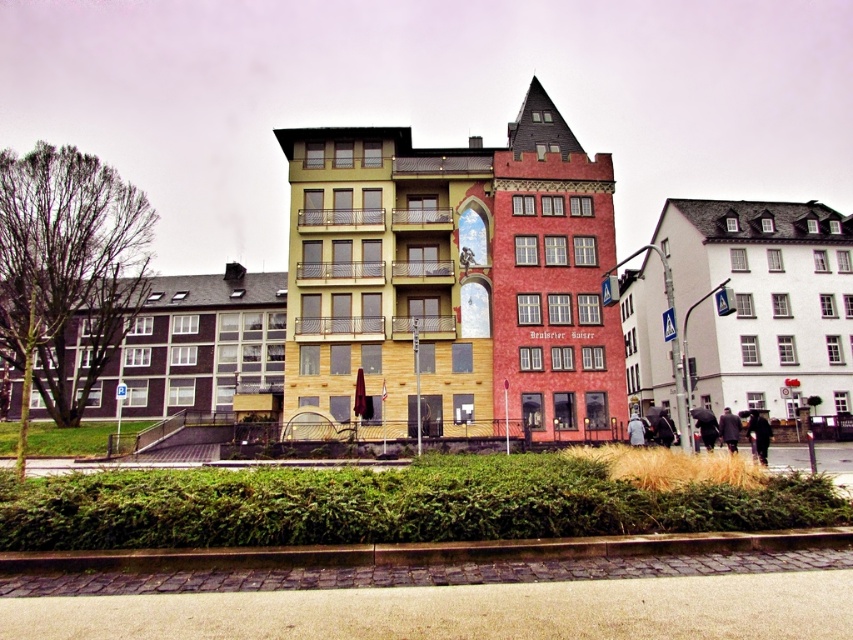
Question: Which point appears closest to the camera in this image?

Choices:
 (A) (633, 444)
 (B) (767, 516)
 (C) (722, 429)

Answer: (B)

Question: Can you confirm if dark gray jacket at lower right is wider than dark gray fabric coat at center?

Choices:
 (A) yes
 (B) no

Answer: (A)

Question: Can you confirm if dark gray jacket at lower right is positioned above dark gray fabric coat at center?

Choices:
 (A) yes
 (B) no

Answer: (A)

Question: Which of these objects is positioned farthest from the black leather jacket at lower right?

Choices:
 (A) dark blue jacket at lower right
 (B) dark gray jacket at lower right
 (C) green leafy hedge at lower center
 (D) dark gray fabric coat at center

Answer: (C)

Question: Which point is closer to the camera?

Choices:
 (A) (689, 484)
 (B) (631, 426)
 (C) (701, 413)

Answer: (A)

Question: Is green leafy hedge at lower center in front of dark brown coat at lower right?

Choices:
 (A) no
 (B) yes

Answer: (B)